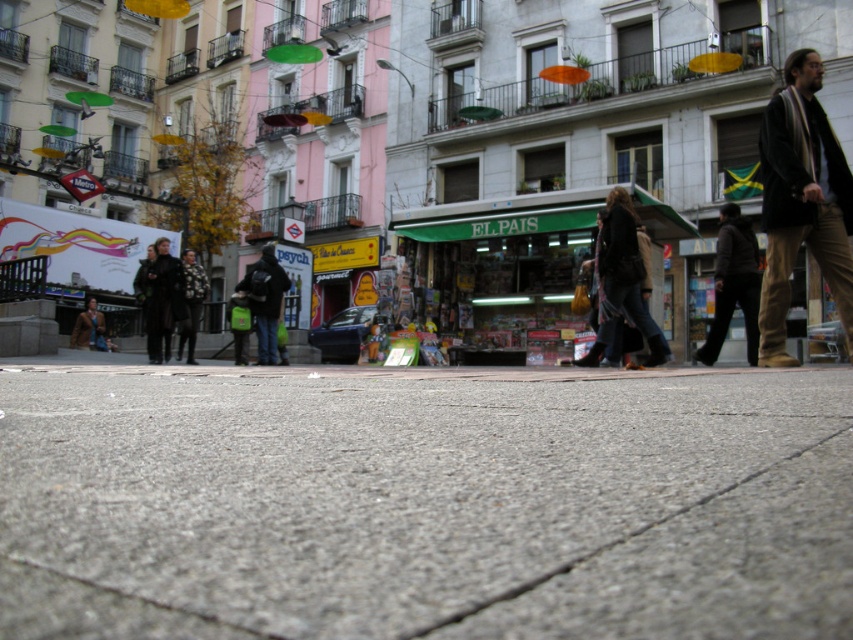
You are a photographer standing on the street and want to take a closeup shot of the dark brown leather jacket at center. The camera you are using has a maximum focus range of 5 meters. Can you capture the jacket clearly?

The dark brown leather jacket at center is 7.60 meters away from camera, which is beyond the maximum focus range of 5 meters. Therefore, you cannot capture the jacket clearly.

You are standing on the street in the image and want to walk towards the closest point between point (625, 269) and point (175, 260). Which point should you head towards?

You should head towards point (625, 269) because it is closer to you than point (175, 260).

Based on the photo, you are standing at point (198, 282) and want to walk to the end of the street. If you look towards the direction you are facing, will point (265, 336) be in front of or behind you?

Point (265, 336) is behind point (198, 282), so if you are facing the direction towards the end of the street, point (265, 336) will be behind you.